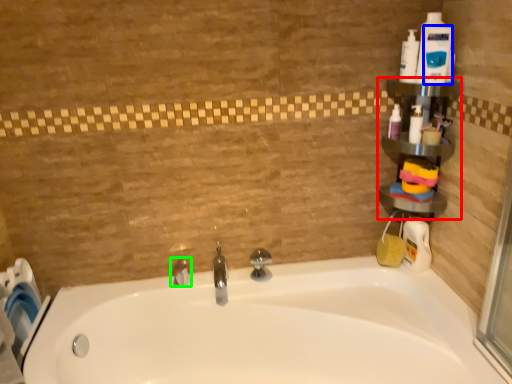
Question: Which object is the farthest from shelf (highlighted by a red box)? Choose among these: cleaning product (highlighted by a blue box) or tap (highlighted by a green box).

Choices:
 (A) cleaning product
 (B) tap

Answer: (B)